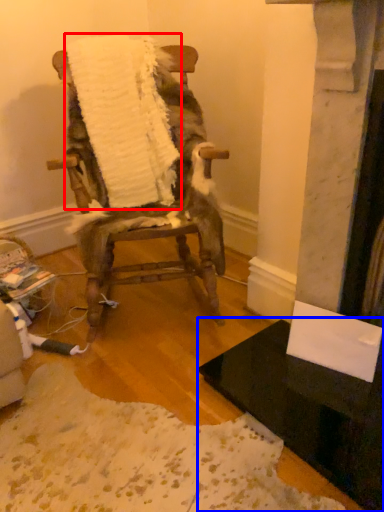
Question: Among these objects, which one is nearest to the camera, blanket (highlighted by a red box) or table (highlighted by a blue box)?

Choices:
 (A) blanket
 (B) table

Answer: (B)